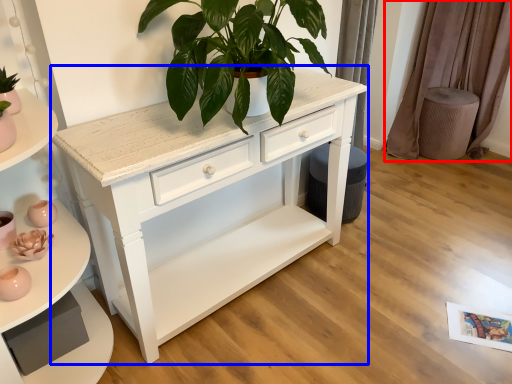
Question: Which point is further to the camera, curtain (highlighted by a red box) or chest of drawers (highlighted by a blue box)?

Choices:
 (A) curtain
 (B) chest of drawers

Answer: (A)